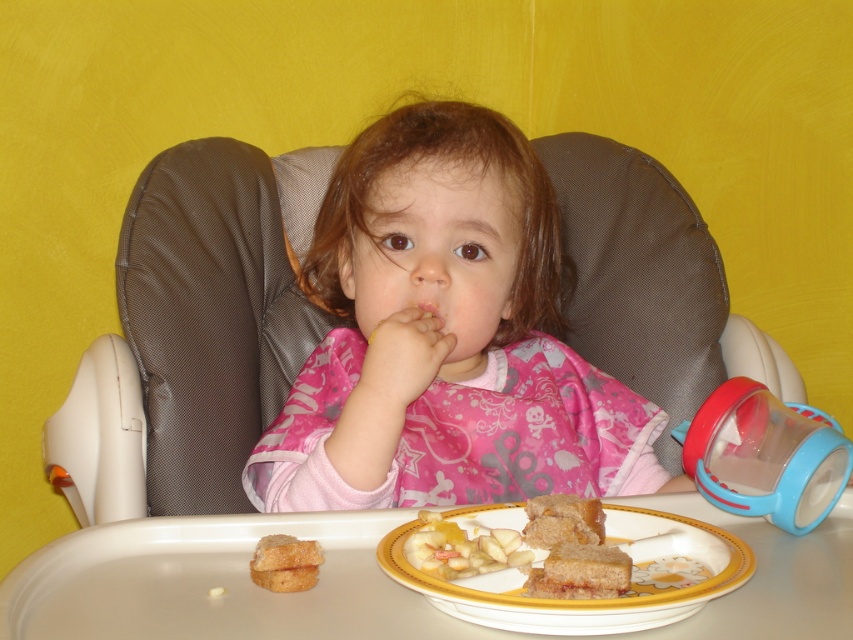
You are a parent trying to decide whether to place a new accessory on the high chair. The accessory requires a space larger than the smooth white bread at plate center. Can the pink fabric bib at center accommodate the accessory?

The pink fabric bib at center has a width larger than the smooth white bread at plate center, so it can accommodate the accessory.

You are a photographer standing at a certain position. You want to take a photo of the child in the high chair while ensuring the pink fabric bib at center is clearly visible. The camera you are using has a focal length that requires the subject to be at least 36 inches away to avoid blurriness. Based on the given information, should you move closer or farther away from the child to get a clear photo?

The pink fabric bib at center and camera are 30.65 inches apart. Since the required minimum distance is 36 inches, you need to move farther away from the child to achieve a clear photo.